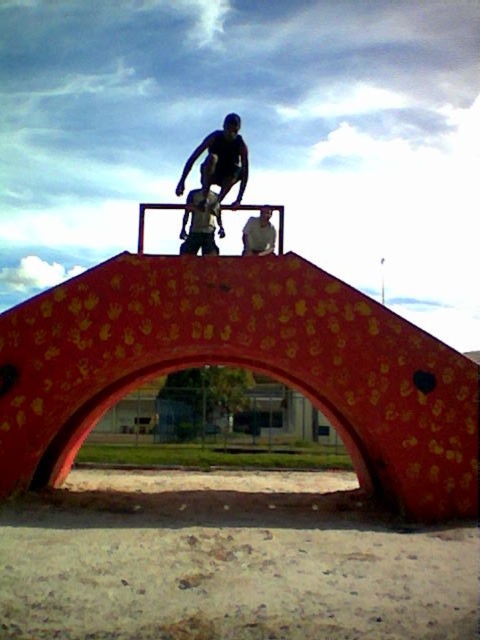
Question: Does white matte shirt at center appear under shiny black skateboard at center?

Choices:
 (A) yes
 (B) no

Answer: (A)

Question: Which object is closer to the camera taking this photo?

Choices:
 (A) shiny black skateboard at center
 (B) matte black skateboarder at center

Answer: (A)

Question: Is matte black skateboarder at center above white matte shirt at center?

Choices:
 (A) no
 (B) yes

Answer: (B)

Question: Which object is the farthest from the white matte shirt at center?

Choices:
 (A) matte black skateboarder at center
 (B) shiny black skateboard at center

Answer: (A)

Question: Can you confirm if matte black skateboarder at center is bigger than white matte shirt at center?

Choices:
 (A) no
 (B) yes

Answer: (B)

Question: Considering the real-world distances, which object is farthest from the white matte shirt at center?

Choices:
 (A) shiny black skateboard at center
 (B) matte black skateboarder at center

Answer: (B)